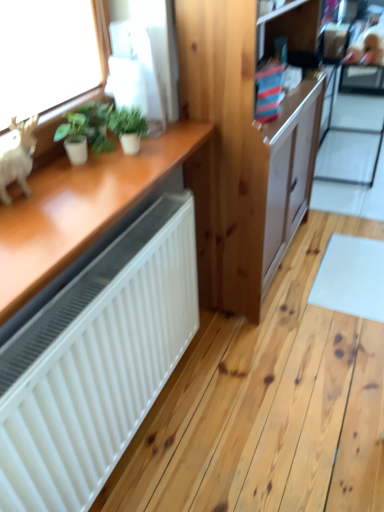
Question: Relative to green matte plant at upper left, arranged as the 2th houseplant when viewed from the left, is white matte figurine at left in front or behind?

Choices:
 (A) behind
 (B) front

Answer: (B)

Question: Based on their positions, is white matte figurine at left located to the left or right of green matte plant at upper left, placed as the 1th houseplant when sorted from right to left?

Choices:
 (A) left
 (B) right

Answer: (A)

Question: Estimate the real-world distances between objects in this image. Which object is farther from the green matte plant at upper left, arranged as the 2th houseplant when viewed from the left?

Choices:
 (A) white matte figurine at left
 (B) natural wood cabinet at center
 (C) green matte plant at upper left, the second houseplant in the right-to-left sequence
 (D) transparent glass screen door at upper right

Answer: (D)

Question: Which object is the closest to the green matte plant at upper left, the second houseplant in the right-to-left sequence?

Choices:
 (A) white matte figurine at left
 (B) natural wood cabinet at center
 (C) green matte plant at upper left, placed as the 1th houseplant when sorted from right to left
 (D) transparent glass screen door at upper right

Answer: (C)